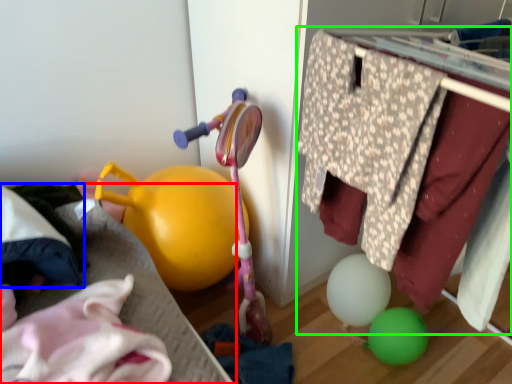
Question: Considering the real-world distances, which object is farthest from bed frame (highlighted by a red box)? clothing (highlighted by a blue box) or closet (highlighted by a green box)?

Choices:
 (A) clothing
 (B) closet

Answer: (B)